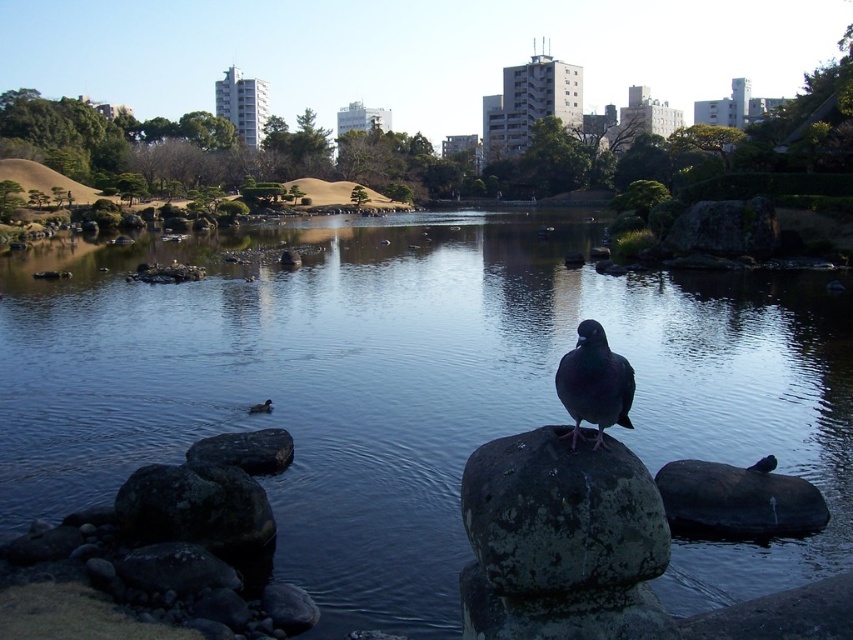
You are a photographer trying to capture a clear shot of the dark gray textured rock at center and the brown matte duck at center in the park scene. Since both are at the center, how can you position your camera to ensure both are in focus?

The dark gray textured rock at center is above the brown matte duck at center, so positioning the camera slightly higher will allow both to be in focus while maintaining their central placement.

You are standing at the edge of the pond in the urban park scene. You want to toss a pebble to hit the smooth gray rock at center. Considering the distance, is it possible for you to reach the rock with an average throw?

The smooth gray rock at center is 10.76 meters from viewer, which is beyond the typical range of an average throw. It would be difficult to reach with a pebble.